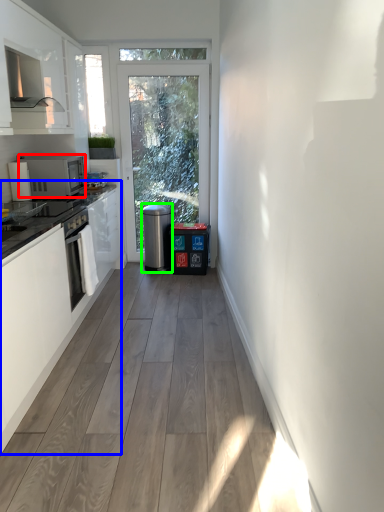
Question: Based on their relative distances, which object is nearer to kitchen appliance (highlighted by a red box)? Choose from cabinetry (highlighted by a blue box) and water heater (highlighted by a green box).

Choices:
 (A) cabinetry
 (B) water heater

Answer: (A)